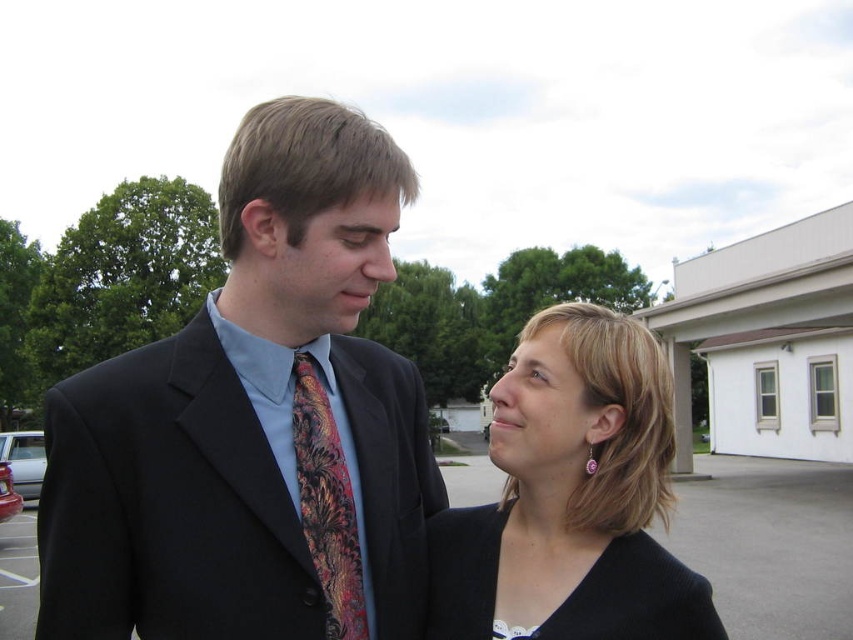
You are a photographer trying to capture a closeup of the black fabric at center and the black knit dress at lower center. Since both are black, how can you distinguish them in the photo?

The black fabric at center is above the black knit dress at lower center, so you can distinguish them by their vertical positions in the photo.

You are a photographer setting up for a portrait. You have a matte black suit at center and asphalt pavement at lower center in your frame. Which object should you focus on if you want to highlight the smaller subject?

The matte black suit at center occupies less space than asphalt pavement at lower center, so you should focus on the matte black suit at center to highlight the smaller subject.

You are a photographer setting up a shot of the matte black suit at center and the asphalt pavement at lower center. You want to ensure the suit is in focus while the pavement is slightly blurred. Based on their positions, is this achievable?

The matte black suit at center is located above asphalt pavement at lower center, so adjusting the camera focus to the suit while keeping the pavement slightly out of focus is achievable.